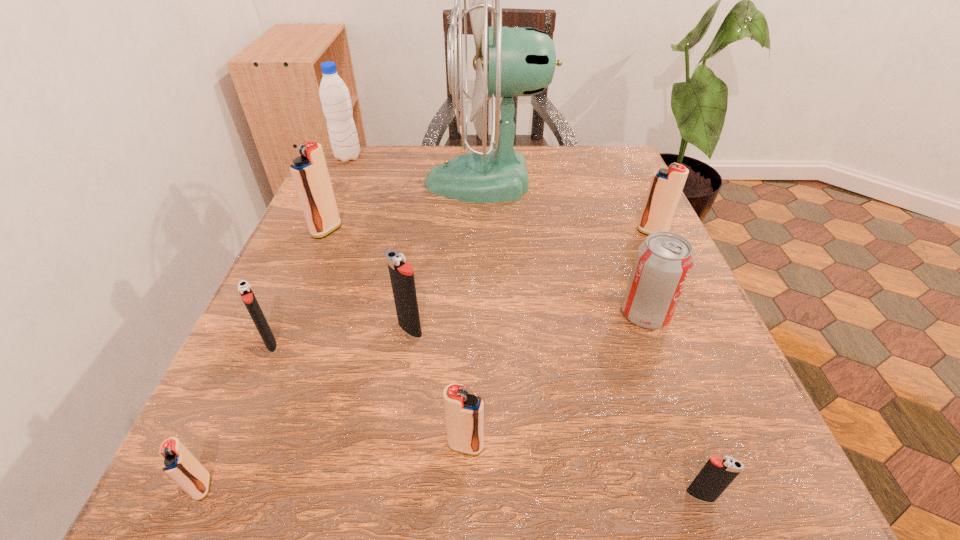
The height and width of the screenshot is (540, 960). In the image, there is a desktop. In order to click on free space at the far right corner in this screenshot , I will do `click(564, 176)`.

You are a GUI agent. You are given a task and a screenshot of the screen. Output one action in this format:
    pyautogui.click(x=<x>, y=<y>)
    Task: Click on the vacant space at the near right corner of the desktop
    The height and width of the screenshot is (540, 960).
    Given the screenshot: What is the action you would take?
    pyautogui.click(x=771, y=471)

Where is `unoccupied position between the smallest red igniter and the leftmost black igniter`? unoccupied position between the smallest red igniter and the leftmost black igniter is located at coordinates (236, 415).

This screenshot has width=960, height=540. What are the coordinates of `empty location between the leftmost black igniter and the soda can` in the screenshot? It's located at (458, 329).

The image size is (960, 540). I want to click on unoccupied position between the rightmost black igniter and the rightmost object, so click(x=676, y=364).

At what (x,y) coordinates should I click in order to perform the action: click on blank region between the smallest red igniter and the tallest object. Please return your answer as a coordinate pair (x, y). The image size is (960, 540). Looking at the image, I should click on (345, 334).

Locate an element on the screen. unoccupied area between the eighth shortest object and the smallest red igniter is located at coordinates (264, 358).

Identify the location of unoccupied area between the rightmost object and the teal fan. The height and width of the screenshot is (540, 960). (569, 207).

Where is `free space between the second black igniter from right to left and the gray water bottle`? The height and width of the screenshot is (540, 960). free space between the second black igniter from right to left and the gray water bottle is located at coordinates (379, 243).

Identify the location of free area in between the second tallest object and the biggest red igniter. (337, 193).